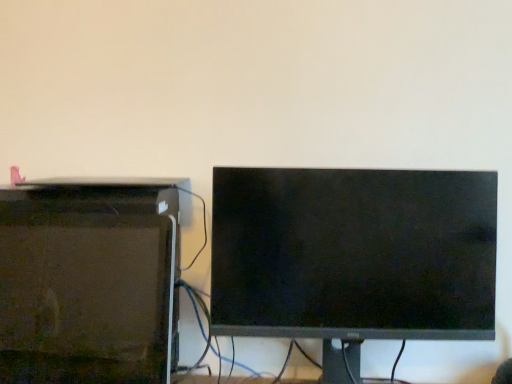
What is the approximate width of matte black desktop computer at left?

matte black desktop computer at left is 6.09 inches in width.

Locate an element on the screen. The height and width of the screenshot is (384, 512). matte black desktop computer at left is located at coordinates (88, 282).

Image resolution: width=512 pixels, height=384 pixels. Describe the element at coordinates (88, 282) in the screenshot. I see `matte black desktop computer at left` at that location.

What is the approximate width of black matte monitor at center?

It is 22.07 centimeters.

Identify the location of black matte monitor at center. (353, 255).

Looking at this image, measure the distance between point (414,224) and camera.

They are 36.57 inches apart.

Image resolution: width=512 pixels, height=384 pixels. What do you see at coordinates (353, 255) in the screenshot?
I see `black matte monitor at center` at bounding box center [353, 255].

What is the approximate height of black matte monitor at center?

black matte monitor at center is 21.49 inches tall.

The height and width of the screenshot is (384, 512). Find the location of `matte black desktop computer at left`. matte black desktop computer at left is located at coordinates (88, 282).

Is black matte monitor at center to the left of matte black desktop computer at left from the viewer's perspective?

No.

Considering their positions, is black matte monitor at center located in front of or behind matte black desktop computer at left?

Clearly, black matte monitor at center is behind matte black desktop computer at left.

Does point (350, 212) come closer to viewer compared to point (14, 325)?

No, it is not.

From the image's perspective, is black matte monitor at center located above or below matte black desktop computer at left?

black matte monitor at center is above matte black desktop computer at left.

From a real-world perspective, is black matte monitor at center physically above matte black desktop computer at left?

Yes, from a real-world perspective, black matte monitor at center is above matte black desktop computer at left.

Considering the sizes of black matte monitor at center and matte black desktop computer at left in the image, is black matte monitor at center wider or thinner than matte black desktop computer at left?

black matte monitor at center is wider than matte black desktop computer at left.

Considering the sizes of objects black matte monitor at center and matte black desktop computer at left in the image provided, who is shorter, black matte monitor at center or matte black desktop computer at left?

matte black desktop computer at left.

Considering the sizes of objects black matte monitor at center and matte black desktop computer at left in the image provided, who is smaller, black matte monitor at center or matte black desktop computer at left?

With smaller size is matte black desktop computer at left.

Is black matte monitor at center surrounding matte black desktop computer at left?

No, matte black desktop computer at left is not surrounded by black matte monitor at center.

Would you say black matte monitor at center is a long distance from matte black desktop computer at left?

black matte monitor at center is near matte black desktop computer at left, not far away.

Is matte black desktop computer at left at the back of black matte monitor at center?

No, black matte monitor at center is not facing the opposite direction of matte black desktop computer at left.

How much distance is there between black matte monitor at center and matte black desktop computer at left?

They are 13.11 inches apart.

Where is `computer monitor located on the right of matte black desktop computer at left`? This screenshot has width=512, height=384. computer monitor located on the right of matte black desktop computer at left is located at coordinates point(353,255).

Can you confirm if matte black desktop computer at left is positioned to the right of black matte monitor at center?

In fact, matte black desktop computer at left is to the left of black matte monitor at center.

Considering their positions, is matte black desktop computer at left located in front of or behind black matte monitor at center?

matte black desktop computer at left is in front of black matte monitor at center.

Considering the points (1, 250) and (439, 250), which point is in front, point (1, 250) or point (439, 250)?

The point (1, 250) is more forward.

From the image's perspective, is matte black desktop computer at left located above or below black matte monitor at center?

Based on their image positions, matte black desktop computer at left is located beneath black matte monitor at center.

From a real-world perspective, between matte black desktop computer at left and black matte monitor at center, who is vertically higher?

In real-world perspective, black matte monitor at center is above.

Is matte black desktop computer at left wider or thinner than black matte monitor at center?

Considering their sizes, matte black desktop computer at left looks slimmer than black matte monitor at center.

Which of these two, matte black desktop computer at left or black matte monitor at center, stands taller?

black matte monitor at center is taller.

Considering the relative sizes of matte black desktop computer at left and black matte monitor at center in the image provided, is matte black desktop computer at left bigger than black matte monitor at center?

No.

Is black matte monitor at center completely or partially inside matte black desktop computer at left?

No.

Is matte black desktop computer at left with black matte monitor at center?

No, matte black desktop computer at left is not in contact with black matte monitor at center.

Is black matte monitor at center at the back of matte black desktop computer at left?

No.

How different are the orientations of matte black desktop computer at left and black matte monitor at center in degrees?

0.000492 degrees.

Find the location of a particular element. The width and height of the screenshot is (512, 384). computer monitor that appears above the matte black desktop computer at left (from the image's perspective) is located at coordinates (353, 255).

Where is `computer monitor above the matte black desktop computer at left (from a real-world perspective)`? computer monitor above the matte black desktop computer at left (from a real-world perspective) is located at coordinates (353, 255).

Find the location of a particular element. computer monitor located on the right of matte black desktop computer at left is located at coordinates (353, 255).